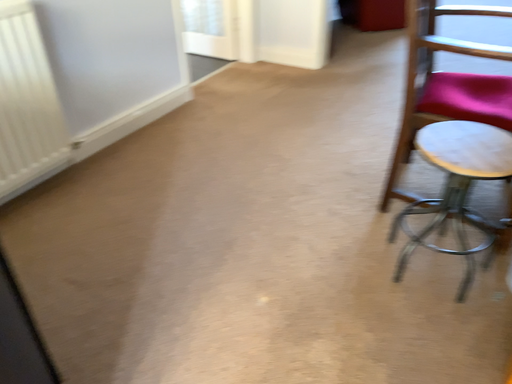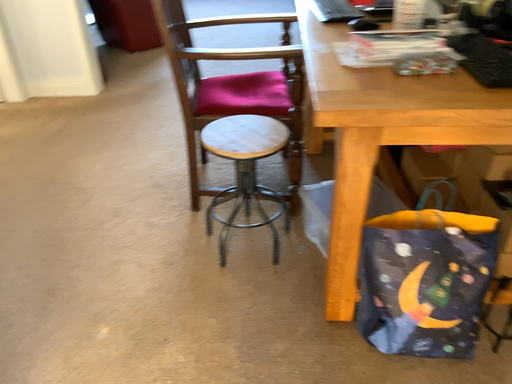
Question: How did the camera likely rotate when shooting the video?

Choices:
 (A) rotated right
 (B) rotated left

Answer: (A)